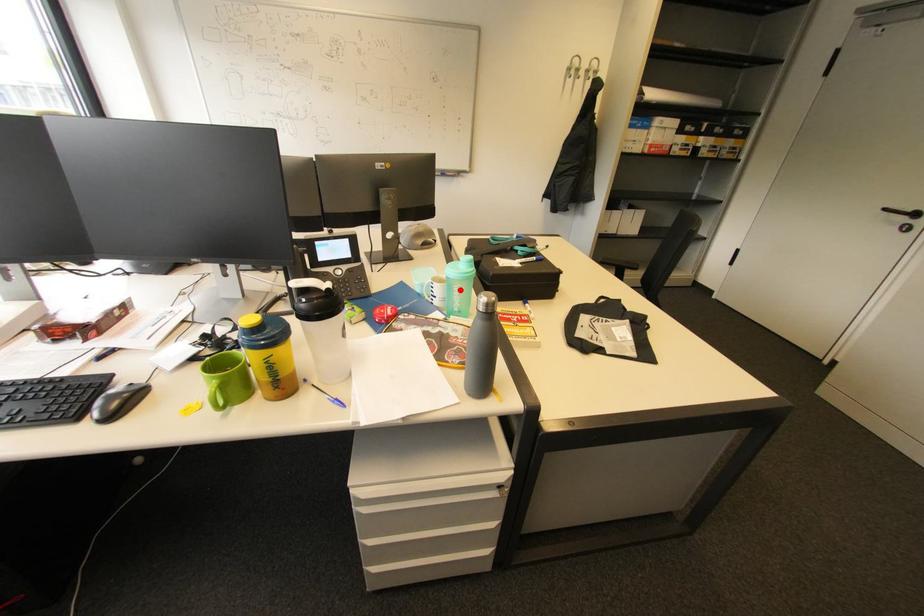
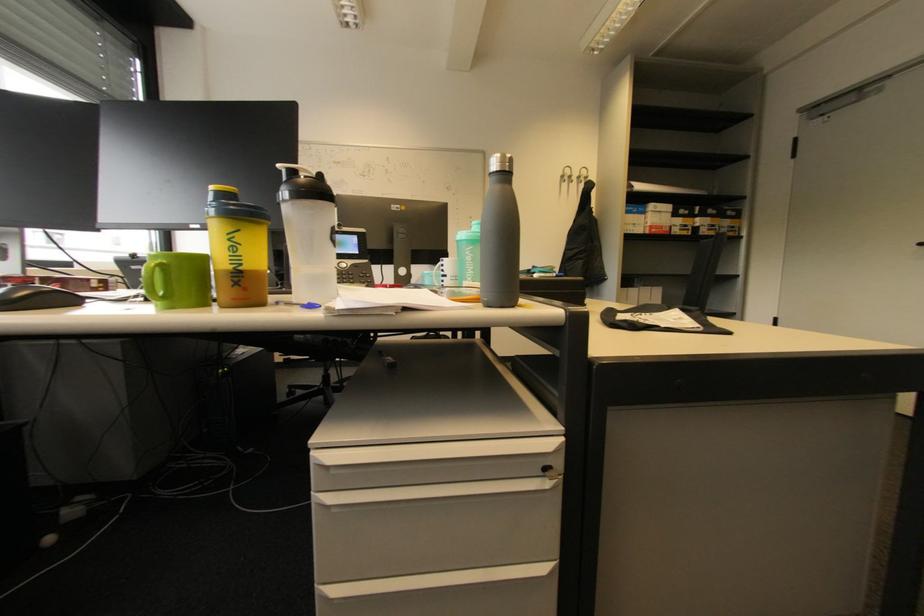
The point at the highlighted location is marked in the first image. Where is the corresponding point in the second image?

(472, 254)